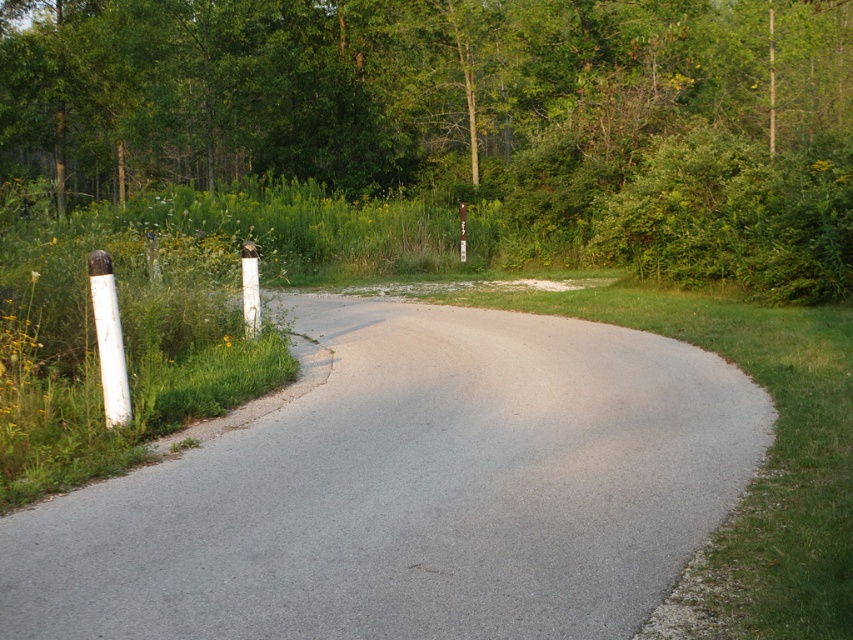
Question: Among these objects, which one is farthest from the camera?

Choices:
 (A) white painted wood post at left
 (B) white plastic pole at left
 (C) gray asphalt road at center

Answer: (B)

Question: Which object is the closest to the white painted wood post at left?

Choices:
 (A) green leafy tree at upper center
 (B) gray asphalt road at center
 (C) white plastic pole at left

Answer: (B)

Question: Can you confirm if white painted wood post at left is positioned to the left of white plastic pole at left?

Choices:
 (A) yes
 (B) no

Answer: (A)

Question: Does white painted wood post at left appear over white plastic pole at left?

Choices:
 (A) no
 (B) yes

Answer: (A)

Question: Which point is closer to the camera taking this photo?

Choices:
 (A) (527, 355)
 (B) (254, 262)

Answer: (A)

Question: Is gray asphalt road at center wider than white painted wood post at left?

Choices:
 (A) no
 (B) yes

Answer: (B)